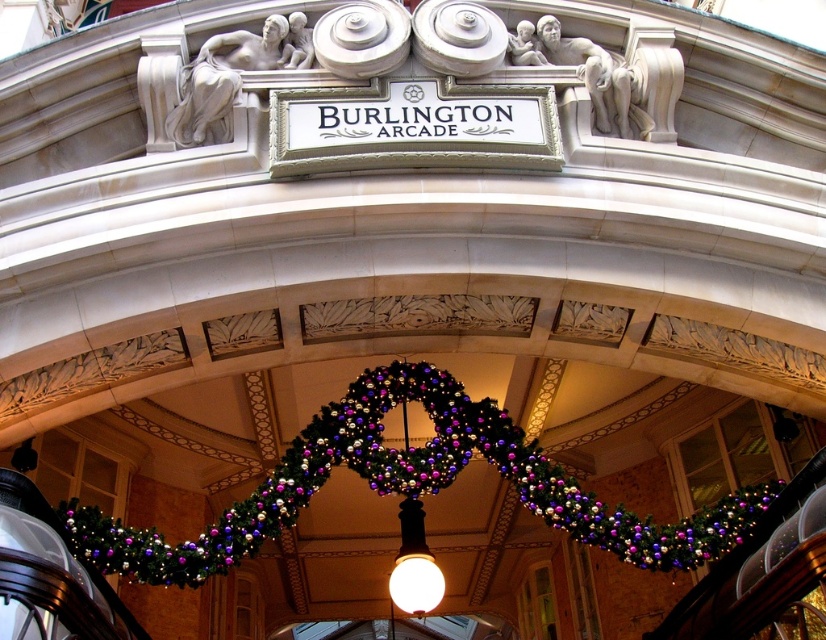
Question: Does green textured garland at center appear over matte white bulb at center?

Choices:
 (A) yes
 (B) no

Answer: (A)

Question: Which point appears farthest from the camera in this image?

Choices:
 (A) (718, 548)
 (B) (402, 548)

Answer: (B)

Question: Which point is closer to the camera taking this photo?

Choices:
 (A) (663, 545)
 (B) (402, 554)

Answer: (A)

Question: Is green textured garland at center closer to camera compared to matte white bulb at center?

Choices:
 (A) yes
 (B) no

Answer: (A)

Question: Is green textured garland at center positioned behind matte white bulb at center?

Choices:
 (A) no
 (B) yes

Answer: (A)